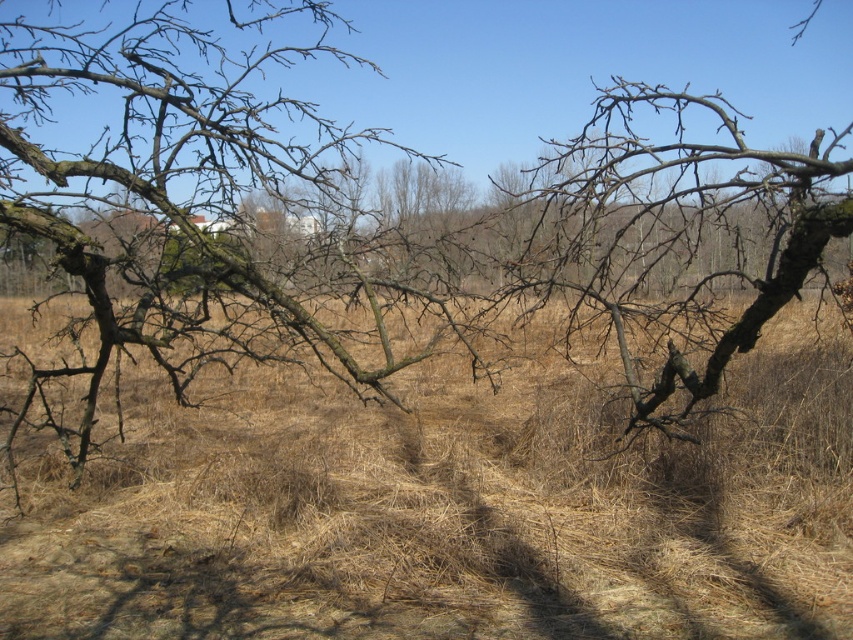
Is brown dry grass at center above brown rough bark tree at center?

No.

Between point (479, 516) and point (160, 353), which one is positioned behind?

The point (160, 353) is behind.

At what (x,y) coordinates should I click in order to perform the action: click on brown dry grass at center. Please return your answer as a coordinate pair (x, y). The width and height of the screenshot is (853, 640). Looking at the image, I should click on (445, 512).